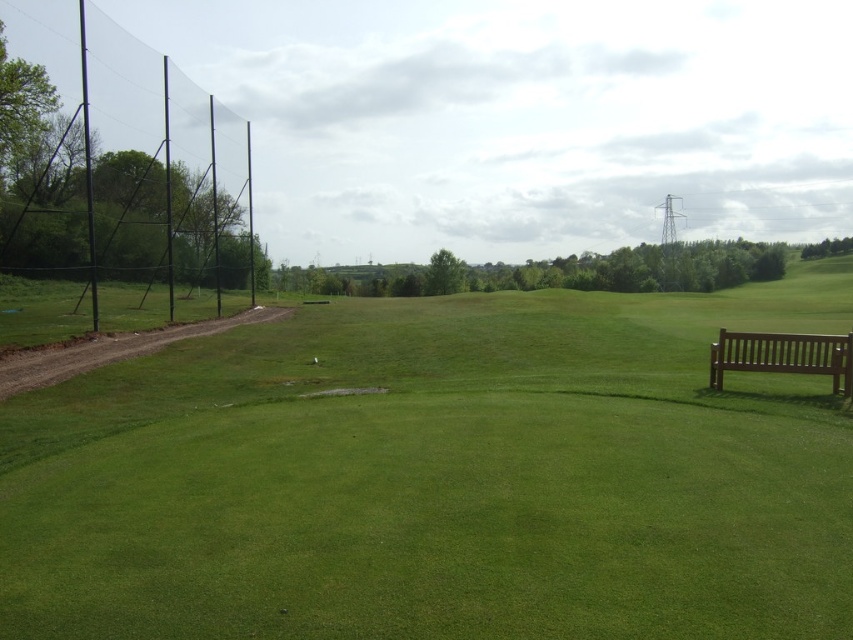
Question: Which object is closer to the camera taking this photo?

Choices:
 (A) brown wooden bench at right
 (B) green smooth grass at center

Answer: (B)

Question: Which point is farther to the camera?

Choices:
 (A) brown wooden bench at right
 (B) green smooth grass at center

Answer: (A)

Question: Is green smooth grass at center bigger than brown wooden bench at right?

Choices:
 (A) no
 (B) yes

Answer: (B)

Question: Can you confirm if green smooth grass at center is bigger than brown wooden bench at right?

Choices:
 (A) yes
 (B) no

Answer: (A)

Question: Can you confirm if green smooth grass at center is positioned above brown wooden bench at right?

Choices:
 (A) no
 (B) yes

Answer: (B)